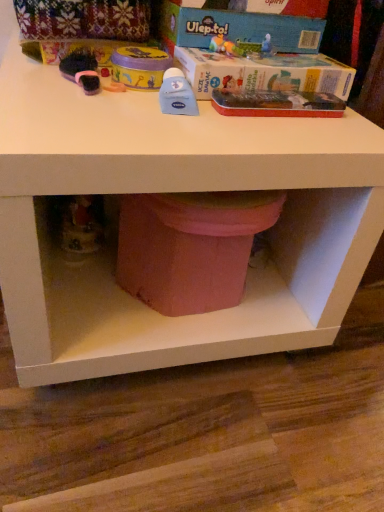
Question: Relative to blue cardboard box at upper center, the 2th box viewed from the top, is blue cardboard box at upper center, which ranks as the 2th box in bottom-to-top order, in front or behind?

Choices:
 (A) behind
 (B) front

Answer: (A)

Question: Is blue cardboard box at upper center, which ranks as the 1th box in top-to-bottom order, wider or thinner than blue cardboard box at upper center, acting as the first box starting from the bottom?

Choices:
 (A) thin
 (B) wide

Answer: (A)

Question: Estimate the real-world distances between objects in this image. Which object is farther from the blue cardboard box at upper center, which ranks as the 1th box in top-to-bottom order?

Choices:
 (A) blue cardboard box at upper center, acting as the first box starting from the bottom
 (B) matte pink potty at lower center

Answer: (B)

Question: Which object is the closest to the blue cardboard box at upper center, which ranks as the 1th box in top-to-bottom order?

Choices:
 (A) blue cardboard box at upper center, the 2th box viewed from the top
 (B) matte pink potty at lower center

Answer: (A)